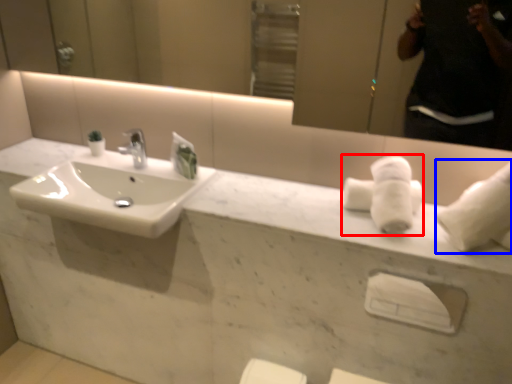
Question: Which point is closer to the camera, bath towel (highlighted by a red box) or bath towel (highlighted by a blue box)?

Choices:
 (A) bath towel
 (B) bath towel

Answer: (B)